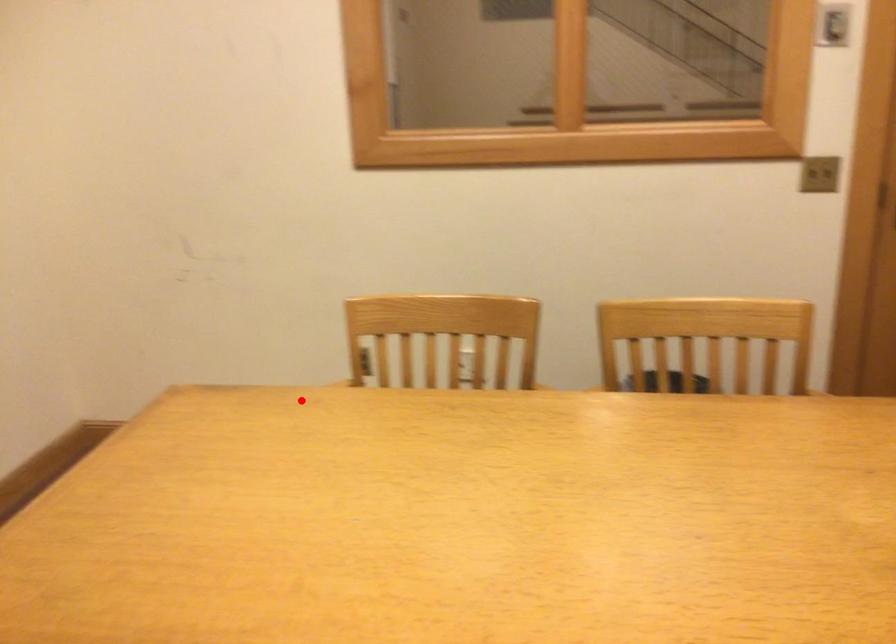
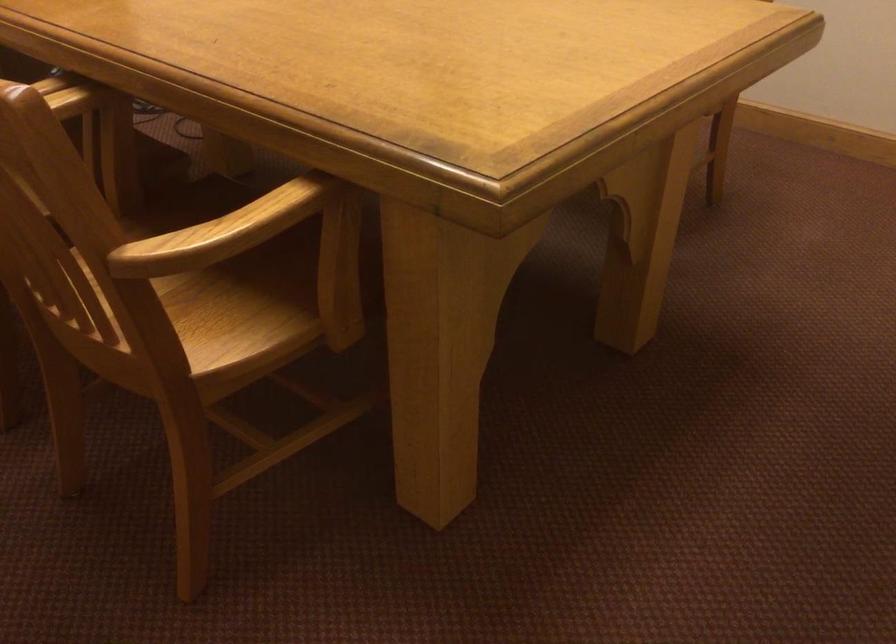
Question: I am providing you with two images of the same scene from different viewpoints. Image1 has a red point marked. In image2, the corresponding 3D location appears at what relative position? Reply with the corresponding letter.

Choices:
 (A) Closer
 (B) Farther

Answer: (A)